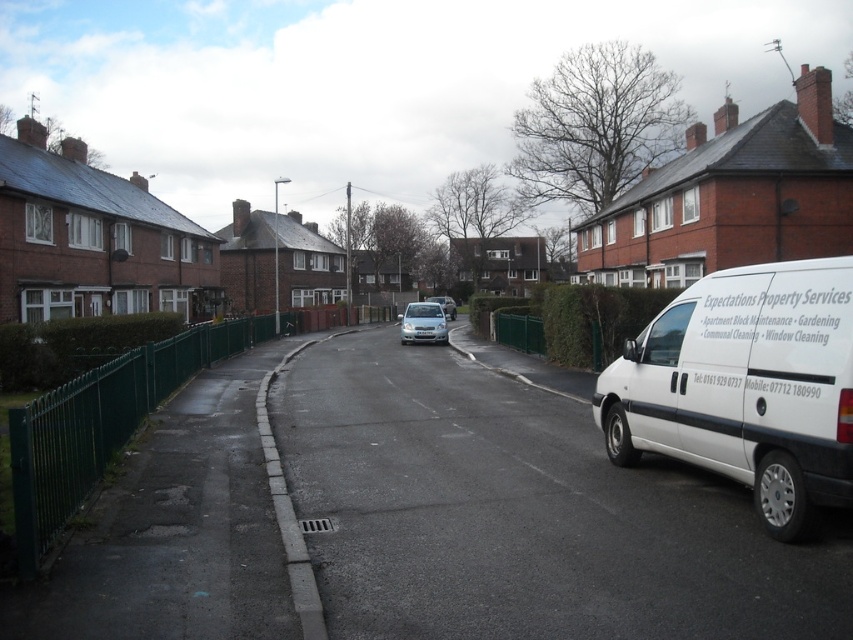
Question: Which of these objects is positioned closest to the satin silver van at center?

Choices:
 (A) white matte van at right
 (B) satin silver car at center

Answer: (B)

Question: Which point is closer to the camera?

Choices:
 (A) (746, 298)
 (B) (430, 296)

Answer: (A)

Question: Is satin silver car at center above satin silver van at center?

Choices:
 (A) no
 (B) yes

Answer: (A)

Question: Considering the relative positions of satin silver car at center and white plastic license plate at center in the image provided, where is satin silver car at center located with respect to white plastic license plate at center?

Choices:
 (A) left
 (B) right

Answer: (A)

Question: Which of these objects is positioned closest to the white plastic license plate at center?

Choices:
 (A) white matte van at right
 (B) satin silver van at center
 (C) satin silver car at center

Answer: (C)

Question: Does satin silver car at center have a lesser width compared to white plastic license plate at center?

Choices:
 (A) yes
 (B) no

Answer: (B)